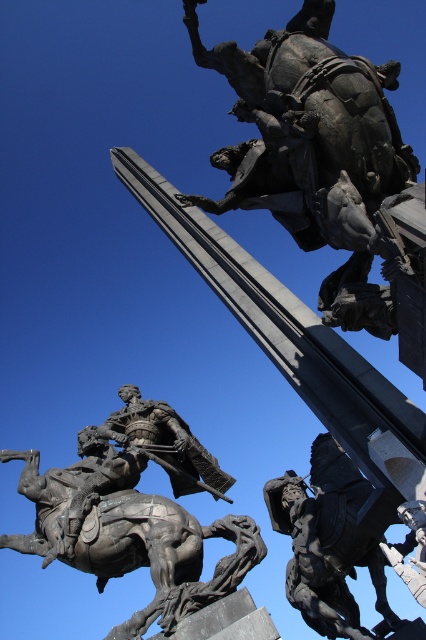
Question: Among these objects, which one is farthest from the camera?

Choices:
 (A) bronze statue at center
 (B) polished bronze rider at center

Answer: (B)

Question: Which point is closer to the camera taking this photo?

Choices:
 (A) (386, 330)
 (B) (42, 531)

Answer: (A)

Question: Estimate the real-world distances between objects in this image. Which object is farther from the bronze textured horse at lower left?

Choices:
 (A) polished bronze rider at center
 (B) bronze statue at center

Answer: (B)

Question: Is bronze textured horse at lower left positioned behind polished bronze rider at center?

Choices:
 (A) no
 (B) yes

Answer: (A)

Question: From the image, what is the correct spatial relationship of bronze textured horse at lower left in relation to bronze statue at center?

Choices:
 (A) above
 (B) below

Answer: (B)

Question: Is bronze statue at upper center thinner than polished bronze rider at center?

Choices:
 (A) no
 (B) yes

Answer: (A)